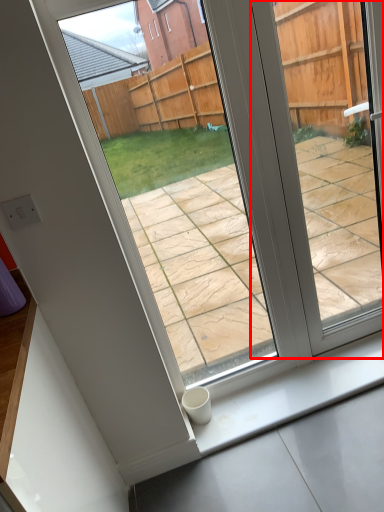
Question: From the image's perspective, what is the correct spatial relationship of window (annotated by the red box) in relation to window sill?

Choices:
 (A) below
 (B) above

Answer: (B)